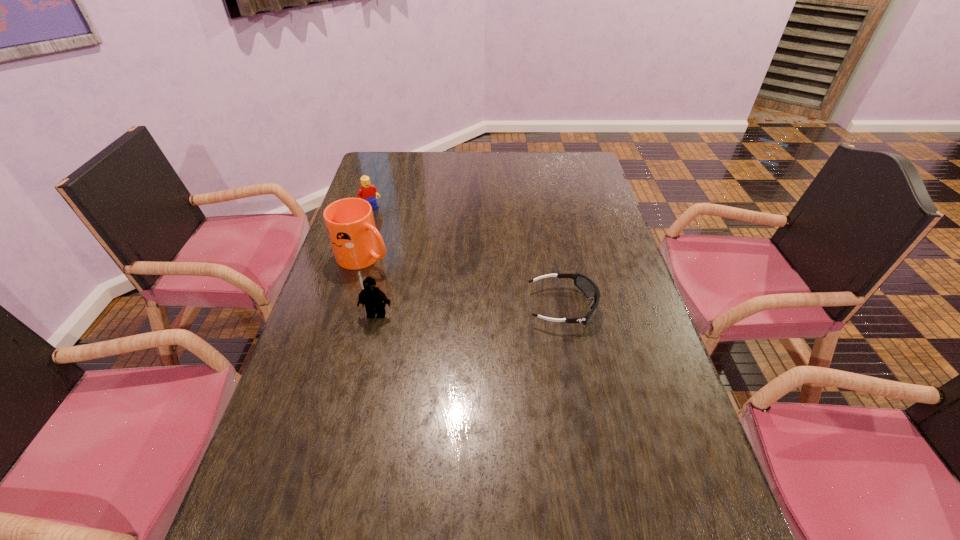
Find the location of a particular element. Image resolution: width=960 pixels, height=540 pixels. free region located on the handle side of the tallest object is located at coordinates (494, 314).

The width and height of the screenshot is (960, 540). Find the location of `vacant space located 0.240m on the handle side of the tallest object`. vacant space located 0.240m on the handle side of the tallest object is located at coordinates (451, 295).

Locate an element on the screen. Image resolution: width=960 pixels, height=540 pixels. vacant point located on the face of the farther Lego is located at coordinates (392, 230).

The image size is (960, 540). I want to click on vacant space positioned on the face of the farther Lego, so click(x=414, y=254).

Locate an element on the screen. The height and width of the screenshot is (540, 960). free region located on the face of the farther Lego is located at coordinates (423, 264).

Where is `mug located at the left edge`? mug located at the left edge is located at coordinates (355, 241).

The height and width of the screenshot is (540, 960). What are the coordinates of `object that is at the right edge` in the screenshot? It's located at (586, 285).

Where is `free region at the far edge`? The image size is (960, 540). free region at the far edge is located at coordinates (446, 180).

This screenshot has height=540, width=960. In the image, there is a desktop. In order to click on vacant region at the near edge in this screenshot , I will do `click(382, 514)`.

In the image, there is a desktop. Identify the location of vacant space at the left edge. The width and height of the screenshot is (960, 540). (346, 273).